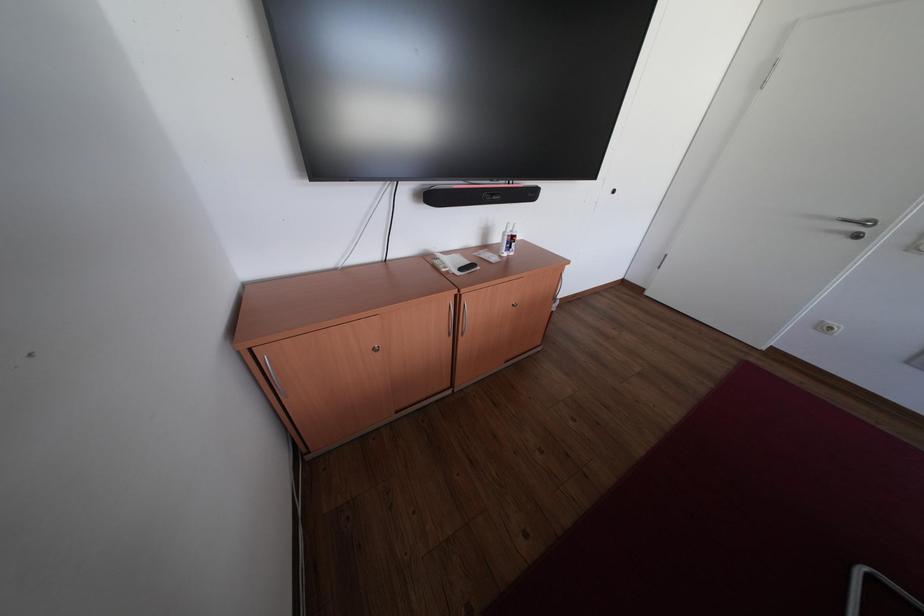
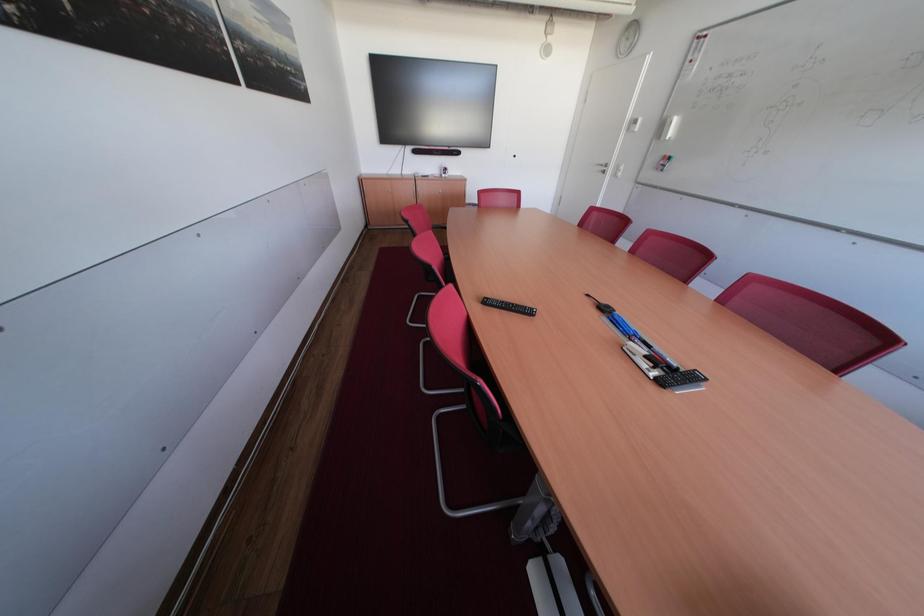
The images are taken continuously from a first-person perspective. In which direction are you moving?

The cameraman walked toward right, backward.